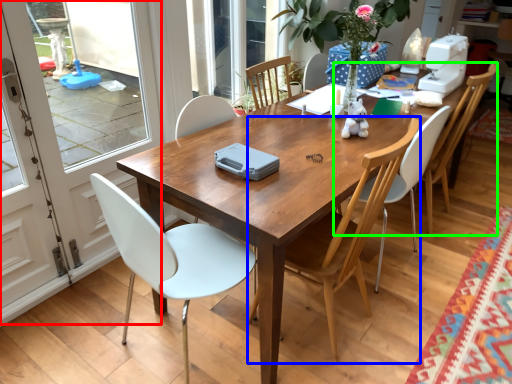
Question: Which object is positioned farthest from screen door (highlighted by a red box)? Select from chair (highlighted by a blue box) and chair (highlighted by a green box).

Choices:
 (A) chair
 (B) chair

Answer: (B)